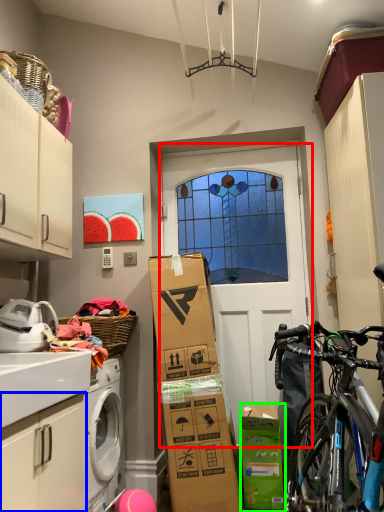
Question: Which object is positioned closest to door (highlighted by a red box)? Select from cabinetry (highlighted by a blue box) and cardboard box (highlighted by a green box).

Choices:
 (A) cabinetry
 (B) cardboard box

Answer: (B)